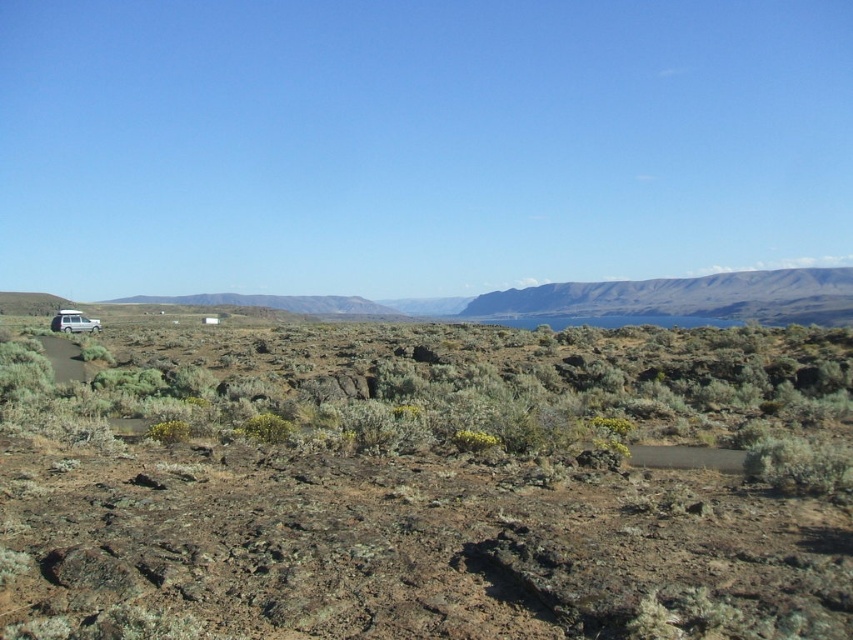
Question: Can you confirm if brown rocky terrain at left is positioned below silver metallic suv at left?

Choices:
 (A) no
 (B) yes

Answer: (B)

Question: Does brown rocky terrain at left appear under silver metallic suv at left?

Choices:
 (A) yes
 (B) no

Answer: (A)

Question: Can you confirm if brown rocky terrain at left is thinner than silver metallic suv at left?

Choices:
 (A) yes
 (B) no

Answer: (B)

Question: Which of the following is the closest to the observer?

Choices:
 (A) (253, 620)
 (B) (57, 316)

Answer: (A)

Question: Which object appears closest to the camera in this image?

Choices:
 (A) silver metallic suv at left
 (B) brown rocky terrain at left

Answer: (B)

Question: Which of the following is the farthest from the observer?

Choices:
 (A) silver metallic suv at left
 (B) brown rocky terrain at left

Answer: (A)